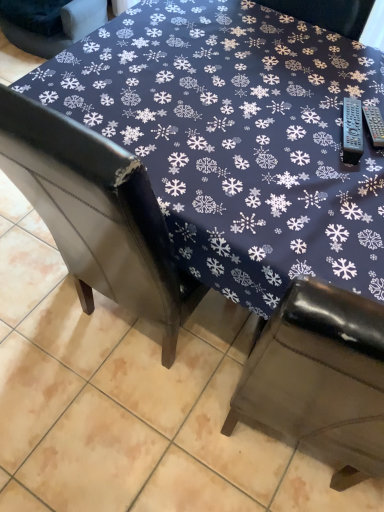
You are a GUI agent. You are given a task and a screenshot of the screen. Output one action in this format:
    pyautogui.click(x=<x>, y=<y>)
    Task: Click on the free location in front of dark blue fabric tablecloth at center
    Image resolution: width=384 pixels, height=512 pixels.
    Given the screenshot: What is the action you would take?
    pyautogui.click(x=110, y=441)